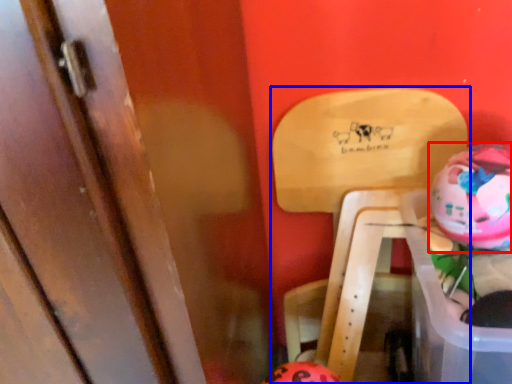
Question: Which of the following is the closest to the observer, piggy bank (highlighted by a red box) or furniture (highlighted by a blue box)?

Choices:
 (A) piggy bank
 (B) furniture

Answer: (A)